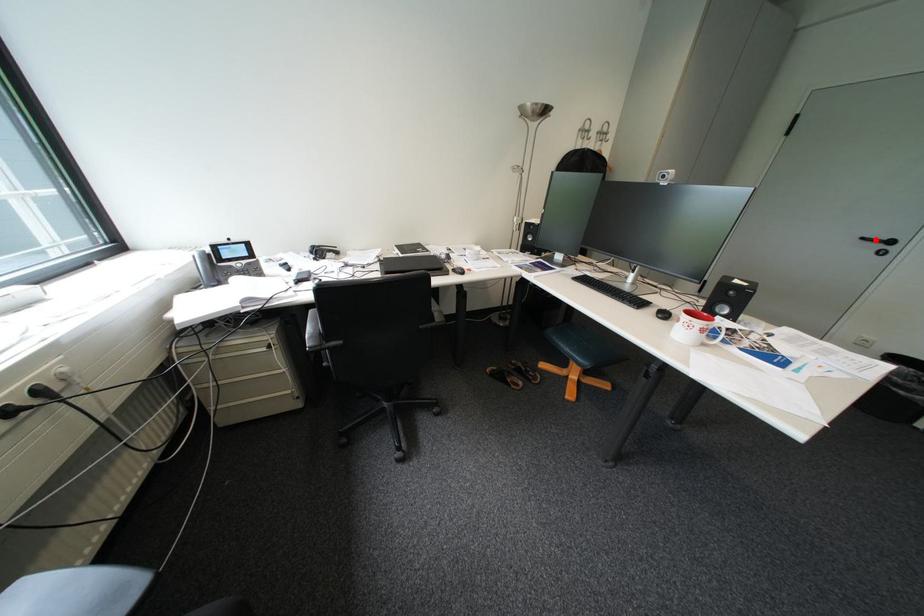
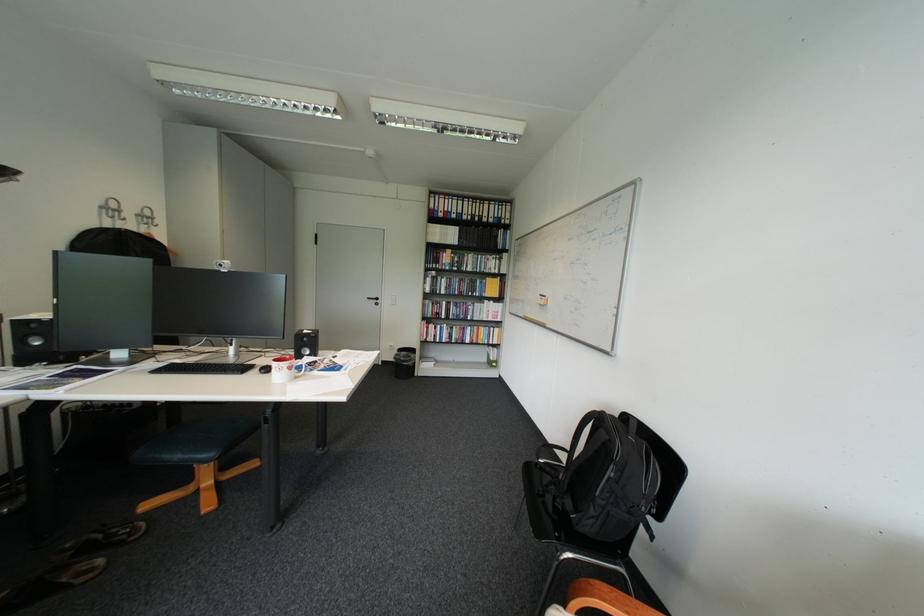
Where in the second image is the point corresponding to the highlighted location from the first image?

(381, 299)